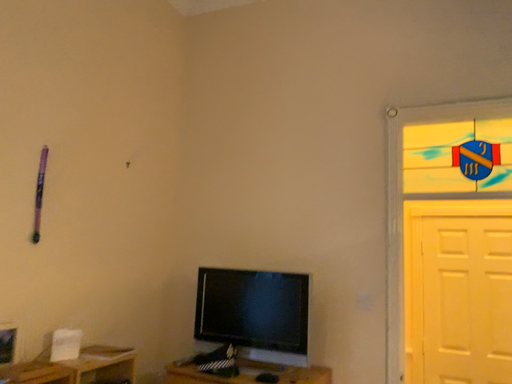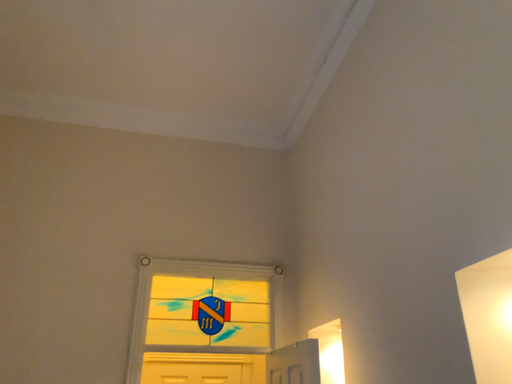
Question: How did the camera likely rotate when shooting the video?

Choices:
 (A) rotated downward
 (B) rotated upward

Answer: (B)